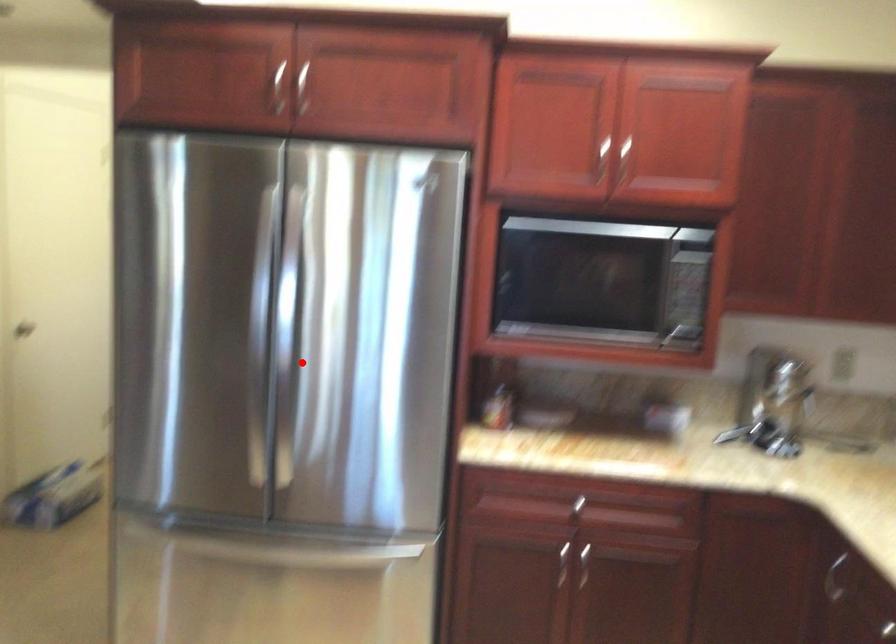
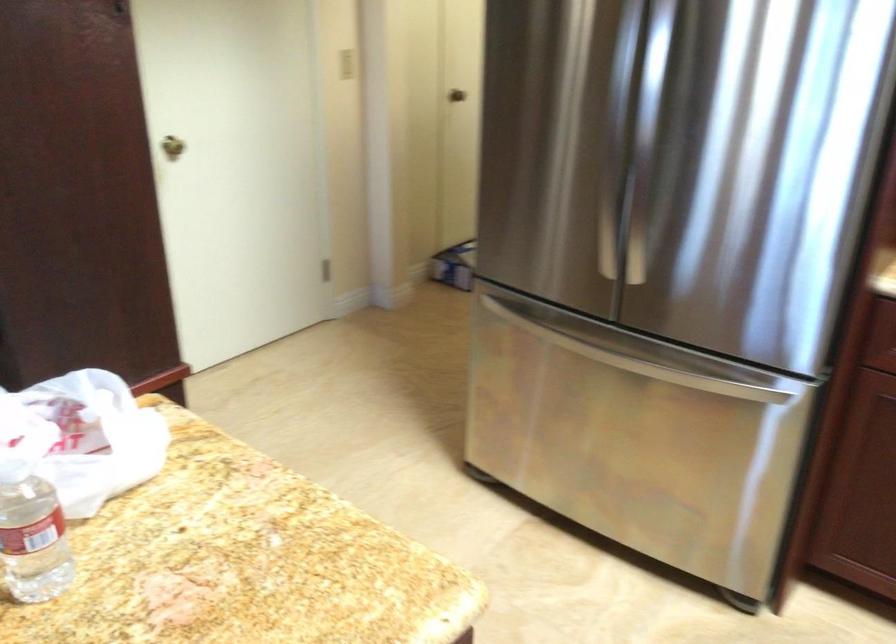
Question: I am providing you with two images of the same scene from different viewpoints. In image1, a red point is highlighted. Considering the same 3D point in image2, which of the following is correct?

Choices:
 (A) It is closer
 (B) It is farther

Answer: (A)